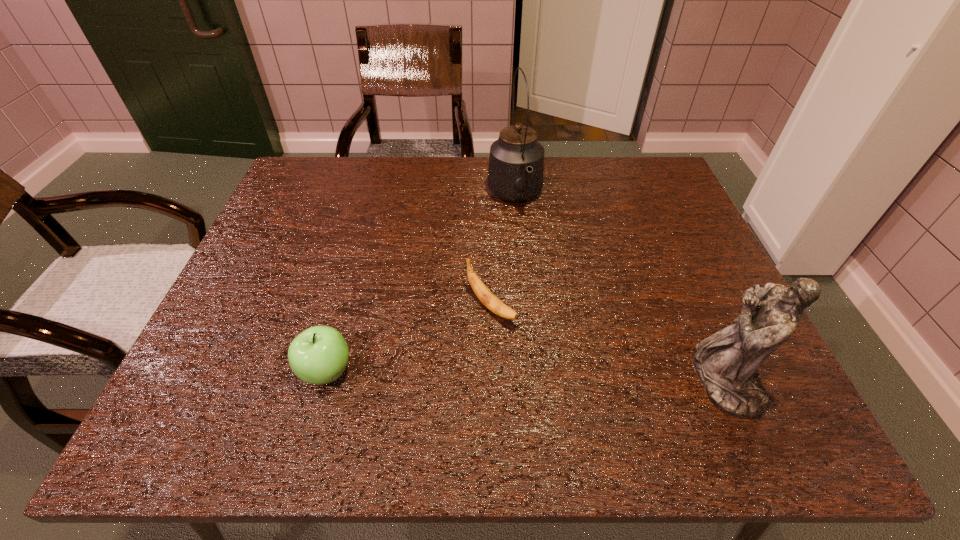
This screenshot has width=960, height=540. Find the location of `free area in between the shortest object and the tallest object`. free area in between the shortest object and the tallest object is located at coordinates (503, 252).

This screenshot has width=960, height=540. What are the coordinates of `object that is the second closest to the shortest object` in the screenshot? It's located at (516, 163).

Identify which object is the nearest to the banana. Please provide its 2D coordinates. Your answer should be formatted as a tuple, i.e. [(x, y)], where the tuple contains the x and y coordinates of a point satisfying the conditions above.

[(319, 355)]

The width and height of the screenshot is (960, 540). Identify the location of vacant region that satisfies the following two spatial constraints: 1. on the back side of the leftmost object; 2. on the right side of the second farthest object. (345, 306).

The width and height of the screenshot is (960, 540). What are the coordinates of `free space that satisfies the following two spatial constraints: 1. on the back side of the second shortest object; 2. on the right side of the farthest object` in the screenshot? It's located at [x=375, y=197].

The width and height of the screenshot is (960, 540). In order to click on vacant region that satisfies the following two spatial constraints: 1. on the back side of the banana; 2. on the left side of the farthest object in this screenshot , I will do `click(489, 197)`.

Image resolution: width=960 pixels, height=540 pixels. What are the coordinates of `free space that satisfies the following two spatial constraints: 1. on the front side of the third shortest object; 2. on the front-facing side of the leftmost object` in the screenshot? It's located at (324, 380).

Where is `free space that satisfies the following two spatial constraints: 1. on the back side of the leftmost object; 2. on the left side of the third nearest object`? This screenshot has height=540, width=960. free space that satisfies the following two spatial constraints: 1. on the back side of the leftmost object; 2. on the left side of the third nearest object is located at coordinates (345, 306).

You are a GUI agent. You are given a task and a screenshot of the screen. Output one action in this format:
    pyautogui.click(x=<x>, y=<y>)
    Task: Click on the free spot that satisfies the following two spatial constraints: 1. on the front side of the apple; 2. on the front-facing side of the second tallest object
    This screenshot has height=540, width=960.
    Given the screenshot: What is the action you would take?
    pyautogui.click(x=324, y=380)

Where is `vacant position in the image that satisfies the following two spatial constraints: 1. on the back side of the shortest object; 2. on the right side of the second shortest object`? This screenshot has width=960, height=540. vacant position in the image that satisfies the following two spatial constraints: 1. on the back side of the shortest object; 2. on the right side of the second shortest object is located at coordinates (345, 306).